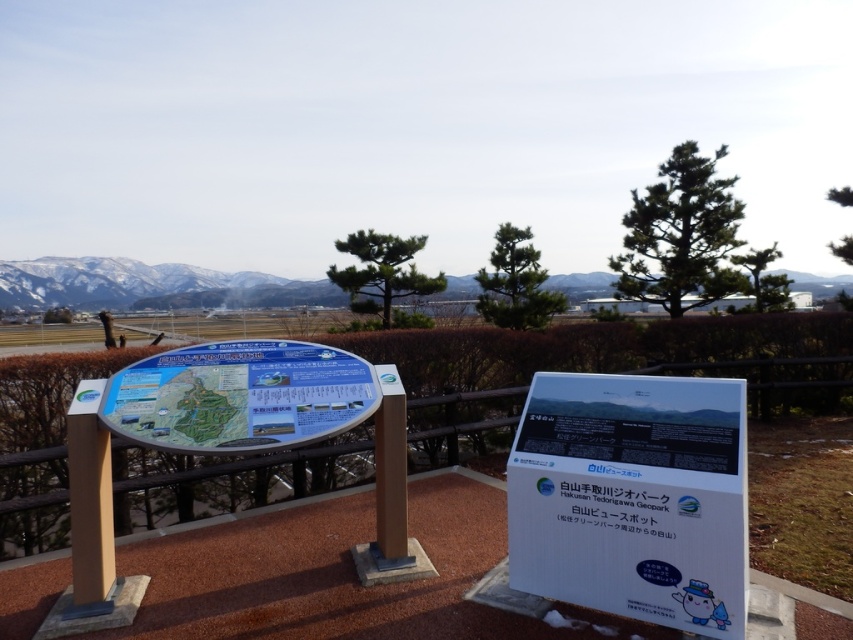
You are standing at the overlook and want to view both the blue plastic map at center and the snowy white mountain at upper center. Which object will appear larger in your field of view?

The blue plastic map at center will appear larger in your field of view because it is closer to the viewer than the snowy white mountain at upper center.

You are standing at the overlook point in the Hakusan Tedorigawa Geopark and want to find the white plastic sign at center. Based on its coordinates, can you determine if it is closer to the railing or the hedge?

The white plastic sign at center is located at point coordinates, which places it closer to the railing than the hedge.